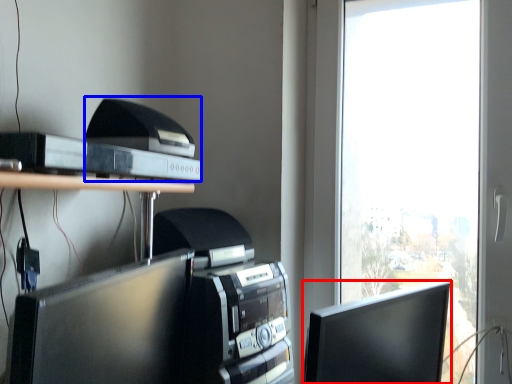
Question: Which object appears farthest to the camera in this image, computer monitor (highlighted by a red box) or printer (highlighted by a blue box)?

Choices:
 (A) computer monitor
 (B) printer

Answer: (B)